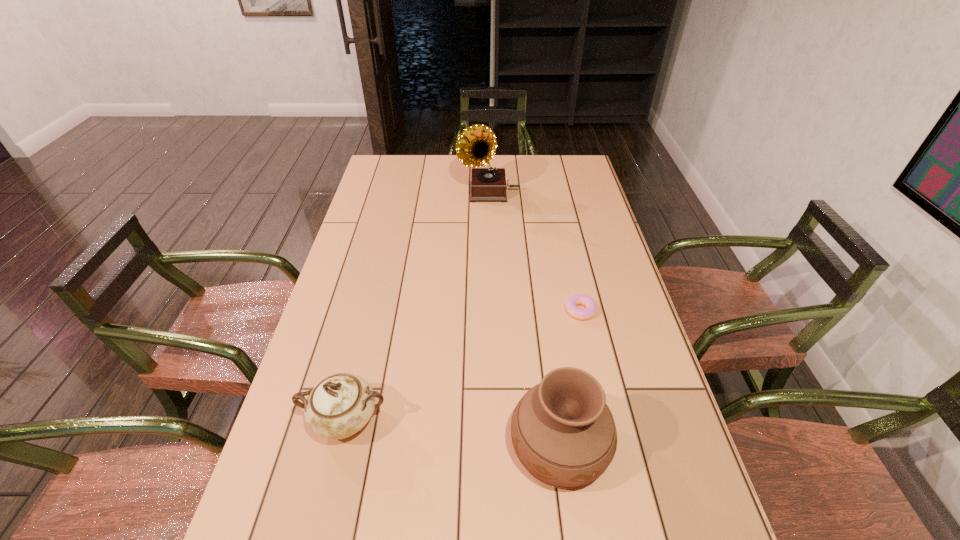
Identify the location of empty location between the leftmost object and the second farthest object. (463, 366).

This screenshot has width=960, height=540. I want to click on free spot between the leftmost object and the urn, so 452,433.

Find the location of a particular element. The width and height of the screenshot is (960, 540). object that is the second closest to the second farthest object is located at coordinates (340, 405).

Image resolution: width=960 pixels, height=540 pixels. I want to click on object that is the second nearest to the tallest object, so click(x=340, y=405).

Where is `vacant space that satisfies the following two spatial constraints: 1. from the horn of the farthest object; 2. on the front side of the second shortest object`? The height and width of the screenshot is (540, 960). vacant space that satisfies the following two spatial constraints: 1. from the horn of the farthest object; 2. on the front side of the second shortest object is located at coordinates (494, 420).

Locate an element on the screen. This screenshot has width=960, height=540. vacant point that satisfies the following two spatial constraints: 1. from the horn of the doughnut; 2. on the right side of the farthest object is located at coordinates (492, 310).

Identify the location of vacant space that satisfies the following two spatial constraints: 1. from the horn of the shortest object; 2. on the left side of the tallest object. (492, 310).

The width and height of the screenshot is (960, 540). I want to click on free space that satisfies the following two spatial constraints: 1. from the horn of the tallest object; 2. on the right side of the second farthest object, so click(x=492, y=310).

Where is `vacant region that satisfies the following two spatial constraints: 1. on the back side of the doughnut; 2. on the right side of the second tallest object`? vacant region that satisfies the following two spatial constraints: 1. on the back side of the doughnut; 2. on the right side of the second tallest object is located at coordinates (540, 310).

Where is `free space in the image that satisfies the following two spatial constraints: 1. from the horn of the tallest object; 2. on the right side of the doughnut`? The height and width of the screenshot is (540, 960). free space in the image that satisfies the following two spatial constraints: 1. from the horn of the tallest object; 2. on the right side of the doughnut is located at coordinates (492, 310).